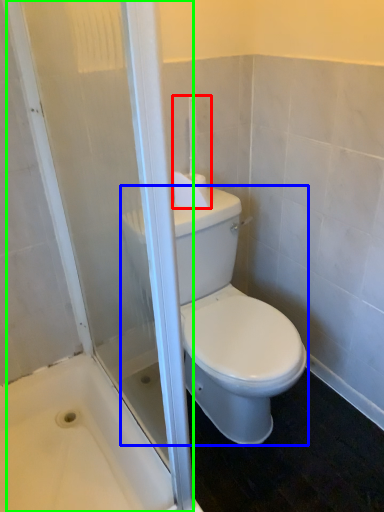
Question: Considering the real-world distances, which object is farthest from towel bar (highlighted by a red box)? porcelain (highlighted by a blue box) or screen door (highlighted by a green box)?

Choices:
 (A) porcelain
 (B) screen door

Answer: (B)